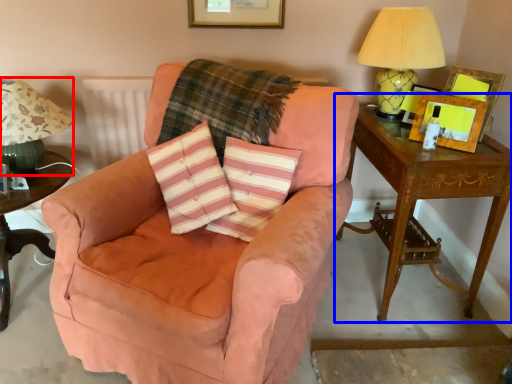
Question: Which of the following is the farthest to the observer, table lamp (highlighted by a red box) or table (highlighted by a blue box)?

Choices:
 (A) table lamp
 (B) table

Answer: (B)